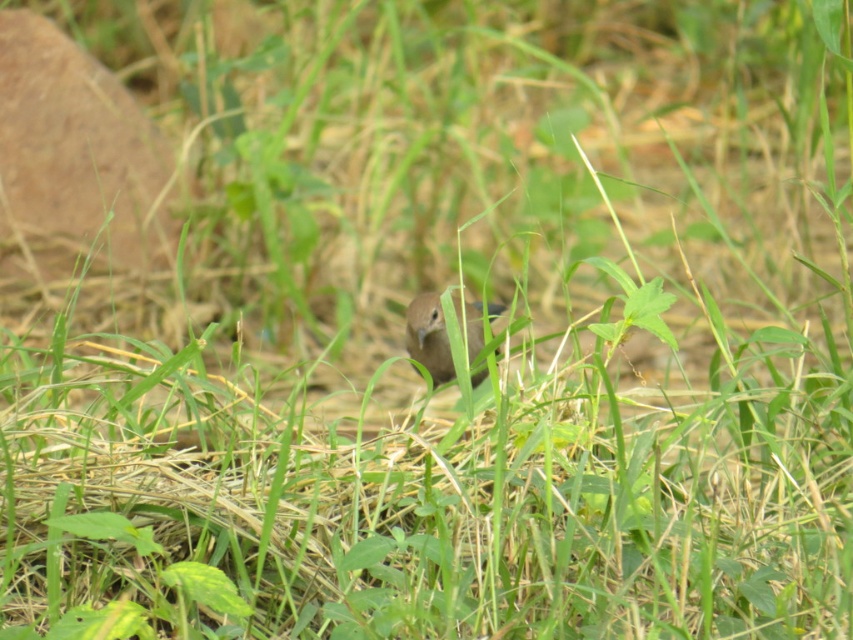
Question: Which point appears closest to the camera in this image?

Choices:
 (A) (445, 380)
 (B) (30, 58)

Answer: (A)

Question: Which point is closer to the camera taking this photo?

Choices:
 (A) (450, 346)
 (B) (45, 29)

Answer: (A)

Question: Which of the following is the farthest from the observer?

Choices:
 (A) (62, 204)
 (B) (415, 320)

Answer: (A)

Question: Can you confirm if brown rock at upper left is positioned to the right of brown matte bird at center?

Choices:
 (A) no
 (B) yes

Answer: (A)

Question: Does brown rock at upper left have a larger size compared to brown matte bird at center?

Choices:
 (A) no
 (B) yes

Answer: (B)

Question: Can you confirm if brown rock at upper left is positioned above brown matte bird at center?

Choices:
 (A) no
 (B) yes

Answer: (B)